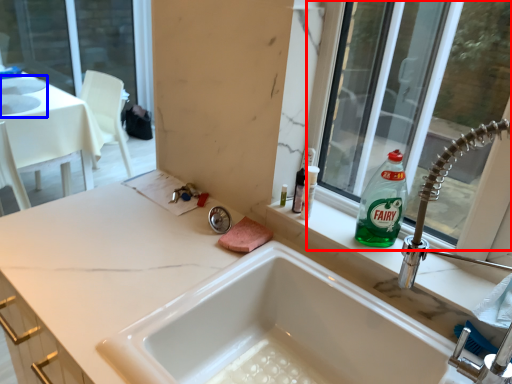
Question: Which object appears farthest to the camera in this image, window (highlighted by a red box) or sink (highlighted by a blue box)?

Choices:
 (A) window
 (B) sink

Answer: (B)